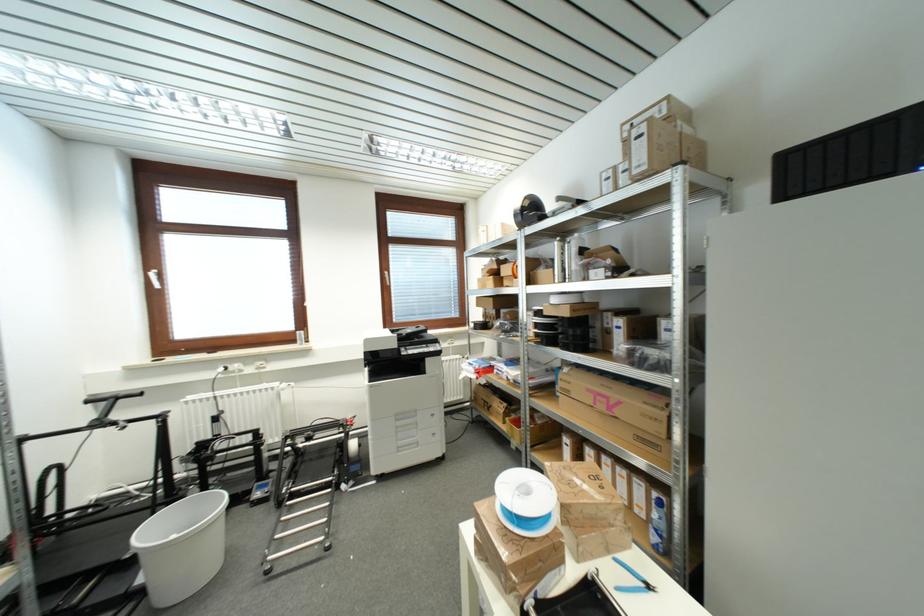
This screenshot has height=616, width=924. Describe the element at coordinates (307, 488) in the screenshot. I see `a rolling step ladder` at that location.